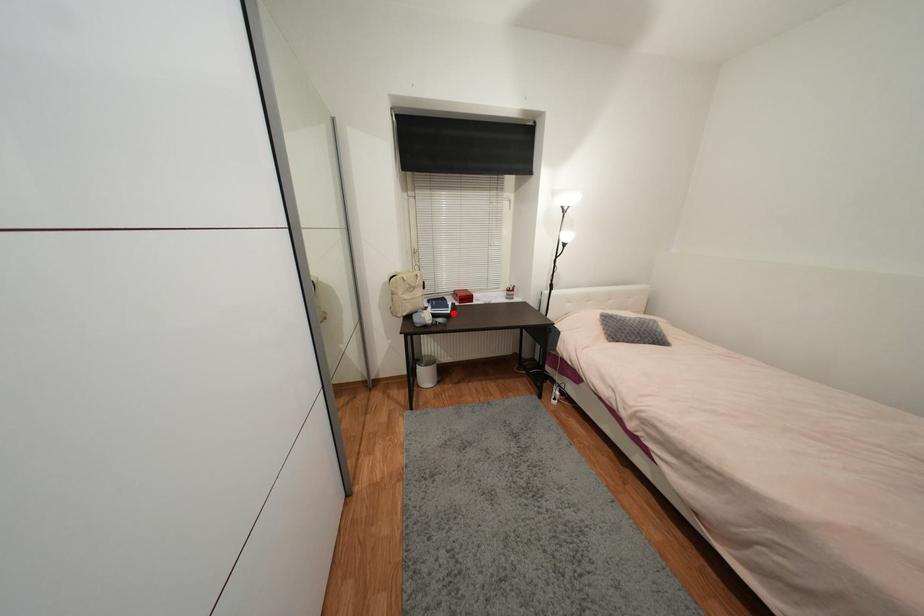
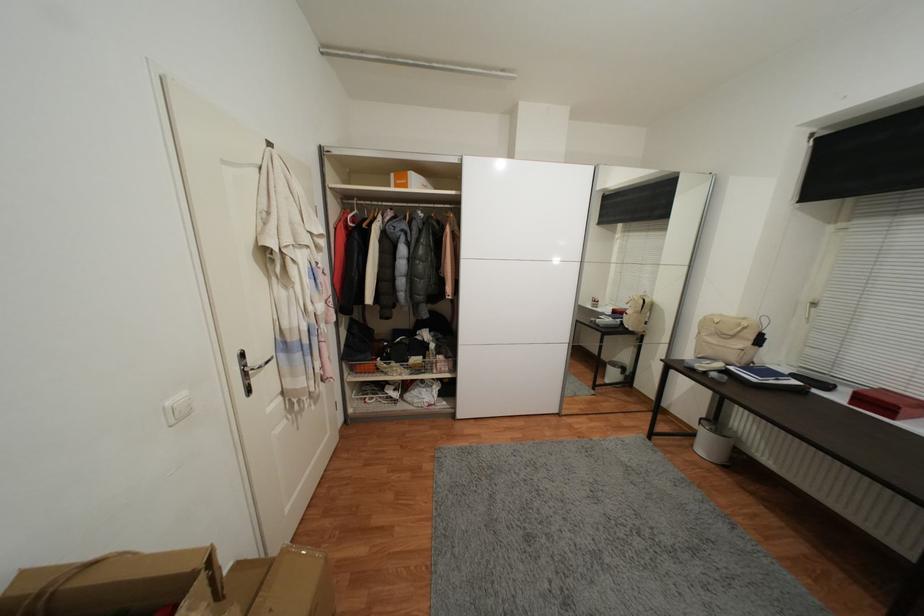
Find the pixel in the second image that matches the highlighted location in the first image.

(759, 381)